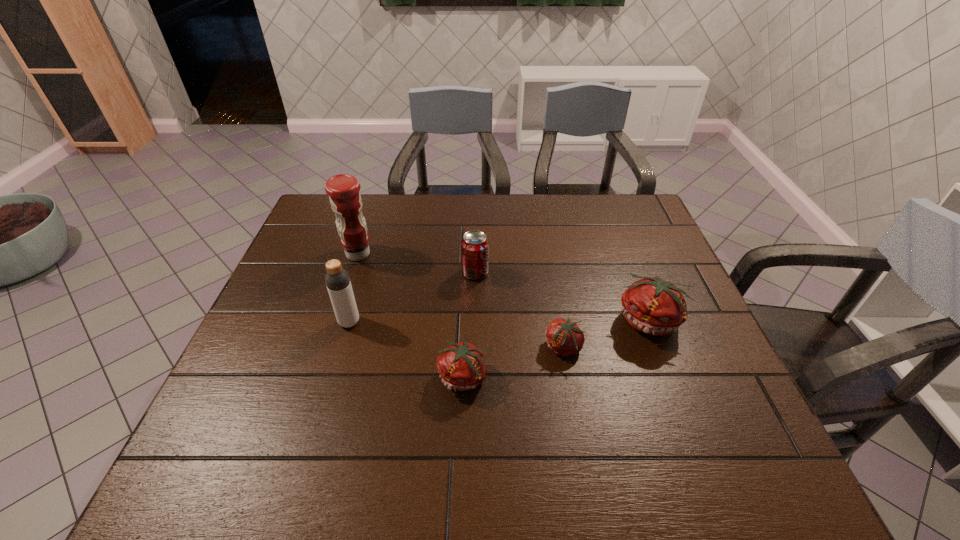
Image resolution: width=960 pixels, height=540 pixels. Identify the location of vacant area between the bottle and the fifth tallest object. (407, 349).

Where is `vacant area between the second tallest tomato and the bottle`? This screenshot has width=960, height=540. vacant area between the second tallest tomato and the bottle is located at coordinates (407, 349).

Identify the location of object that is the second closest to the soda can. The height and width of the screenshot is (540, 960). (462, 366).

Locate which object ranks fourth in proximity to the fifth shortest object. Please provide its 2D coordinates. Your answer should be formatted as a tuple, i.e. [(x, y)], where the tuple contains the x and y coordinates of a point satisfying the conditions above.

[(564, 338)]

Select which tomato is the third closest to the soda can. Please provide its 2D coordinates. Your answer should be formatted as a tuple, i.e. [(x, y)], where the tuple contains the x and y coordinates of a point satisfying the conditions above.

[(652, 305)]

Identify which tomato is the second closest to the leftmost tomato. Please provide its 2D coordinates. Your answer should be formatted as a tuple, i.e. [(x, y)], where the tuple contains the x and y coordinates of a point satisfying the conditions above.

[(652, 305)]

Where is `free space in the image that satisfies the following two spatial constraints: 1. on the back side of the fifth shortest object; 2. on the left side of the soda can`? Image resolution: width=960 pixels, height=540 pixels. free space in the image that satisfies the following two spatial constraints: 1. on the back side of the fifth shortest object; 2. on the left side of the soda can is located at coordinates (364, 273).